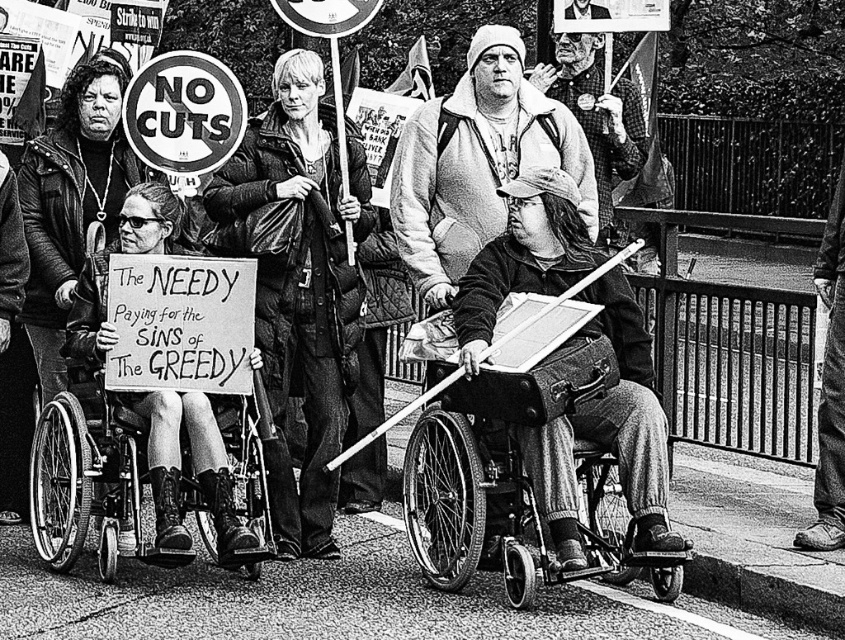
Can you confirm if white cotton hoodie at center is positioned to the left of checkered flannel shirt at center?

Yes, white cotton hoodie at center is to the left of checkered flannel shirt at center.

Can you confirm if white cotton hoodie at center is shorter than checkered flannel shirt at center?

In fact, white cotton hoodie at center may be taller than checkered flannel shirt at center.

Between point (511, 163) and point (620, 145), which one is positioned in front?

Point (511, 163) is in front.

Identify the location of white cotton hoodie at center. The width and height of the screenshot is (845, 640). (477, 163).

This screenshot has height=640, width=845. What do you see at coordinates (145, 483) in the screenshot? I see `metallic wheelchair at lower left` at bounding box center [145, 483].

Can you confirm if metallic wheelchair at lower left is shorter than checkered flannel shirt at center?

Correct, metallic wheelchair at lower left is not as tall as checkered flannel shirt at center.

Between point (259, 497) and point (606, 214), which one is positioned behind?

Positioned behind is point (606, 214).

Where is `metallic wheelchair at lower left`? This screenshot has width=845, height=640. metallic wheelchair at lower left is located at coordinates (145, 483).

Find the location of a particular element. The width and height of the screenshot is (845, 640). black plastic wheelchair at center is located at coordinates (516, 483).

Locate an element on the screen. The width and height of the screenshot is (845, 640). black plastic wheelchair at center is located at coordinates (516, 483).